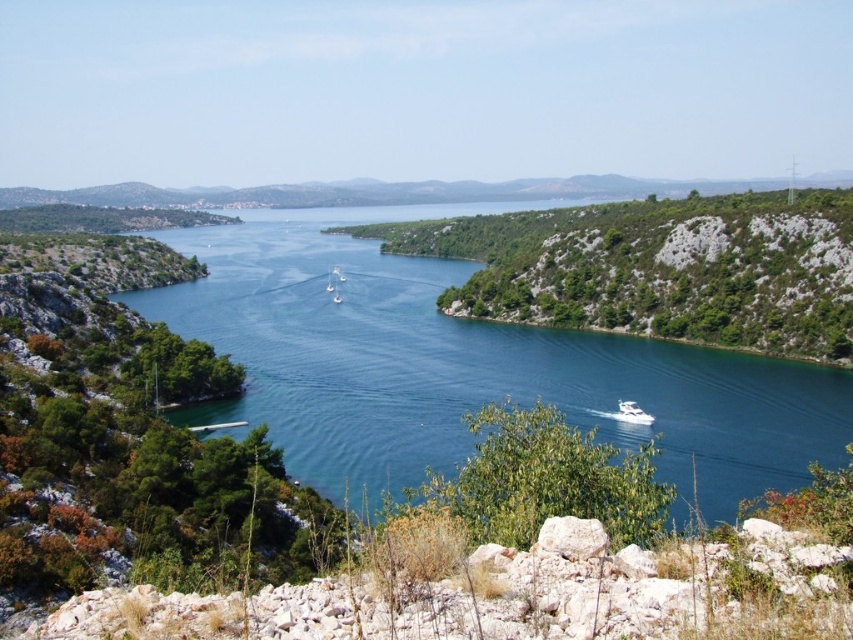
Does green leafy hillside at center have a lesser width compared to white glossy boat at lower right?

No, green leafy hillside at center is not thinner than white glossy boat at lower right.

You are a GUI agent. You are given a task and a screenshot of the screen. Output one action in this format:
    pyautogui.click(x=<x>, y=<y>)
    Task: Click on the green leafy hillside at center
    
    Given the screenshot: What is the action you would take?
    pyautogui.click(x=659, y=268)

Does point (489, 292) come closer to viewer compared to point (633, 406)?

That is False.

At what (x,y) coordinates should I click in order to perform the action: click on green leafy hillside at center. Please return your answer as a coordinate pair (x, y). Looking at the image, I should click on (659, 268).

Does point (724, 412) come farther from viewer compared to point (641, 410)?

That is True.

Between clear blue water at center and white glossy boat at lower right, which one has less height?

Standing shorter between the two is white glossy boat at lower right.

At what (x,y) coordinates should I click in order to perform the action: click on clear blue water at center. Please return your answer as a coordinate pair (x, y). Looking at the image, I should click on (465, 365).

Find the location of `clear blue water at center`. clear blue water at center is located at coordinates (465, 365).

Who is lower down, clear blue water at center or green leafy hillside at center?

clear blue water at center

Between clear blue water at center and green leafy hillside at center, which one has more height?

Standing taller between the two is clear blue water at center.

Does point (317, 333) lie in front of point (669, 228)?

Yes.

This screenshot has width=853, height=640. I want to click on clear blue water at center, so click(x=465, y=365).